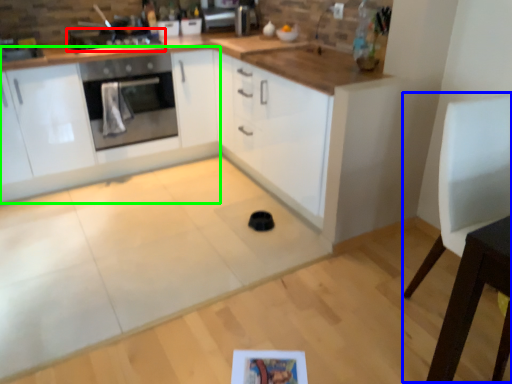
Question: Which object is positioned farthest from kitchen appliance (highlighted by a red box)? Select from chair (highlighted by a blue box) and cabinetry (highlighted by a green box).

Choices:
 (A) chair
 (B) cabinetry

Answer: (A)